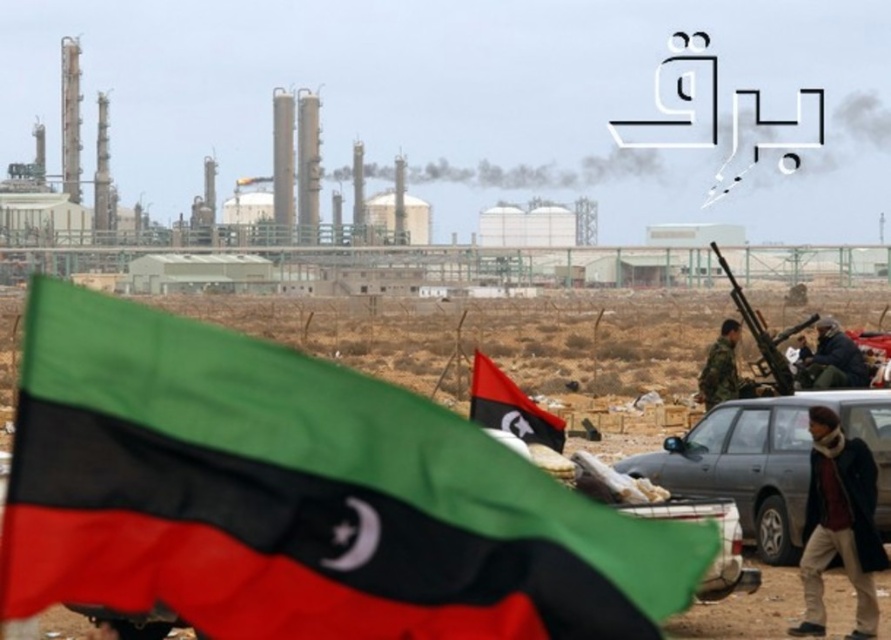
Question: Can you confirm if dark blue wool coat at lower right is thinner than dark blue jacket at center?

Choices:
 (A) yes
 (B) no

Answer: (A)

Question: Is matte gray car at lower right smaller than dark blue jacket at center?

Choices:
 (A) yes
 (B) no

Answer: (B)

Question: Considering the relative positions of polyester flag at lower left and dark blue jacket at center in the image provided, where is polyester flag at lower left located with respect to dark blue jacket at center?

Choices:
 (A) right
 (B) left

Answer: (B)

Question: Based on their relative distances, which object is farther from the polyester flag at lower left?

Choices:
 (A) dark blue wool coat at lower right
 (B) camouflage uniform at right

Answer: (B)

Question: Which point is farther to the camera?

Choices:
 (A) (714, 477)
 (B) (844, 564)
 (C) (708, 385)
 (D) (798, 378)

Answer: (D)

Question: Which point is closer to the camera?

Choices:
 (A) (740, 333)
 (B) (799, 371)
 (C) (480, 416)

Answer: (C)